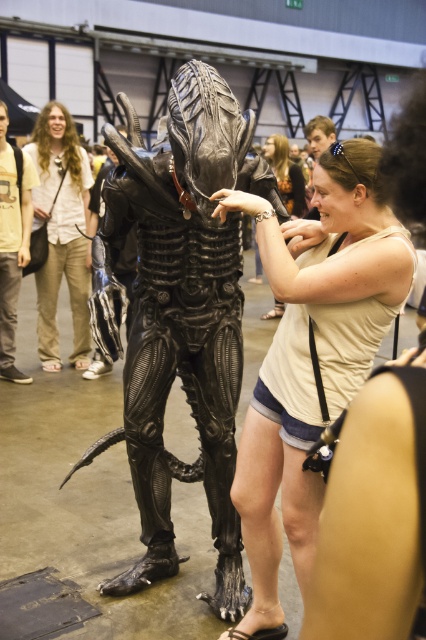
Where is the black matte alien at center located in the image?

The black matte alien at center is located at point (178, 314).

You are an attendee at the event and you want to take a photo of the white matte tank top at center and the matte black hair at upper center. Which one should you focus on first if you want to capture both in the same frame?

You should focus on the white matte tank top at center first because it is positioned to the left of the matte black hair at upper center, so adjusting the camera to include both would require framing from left to right.